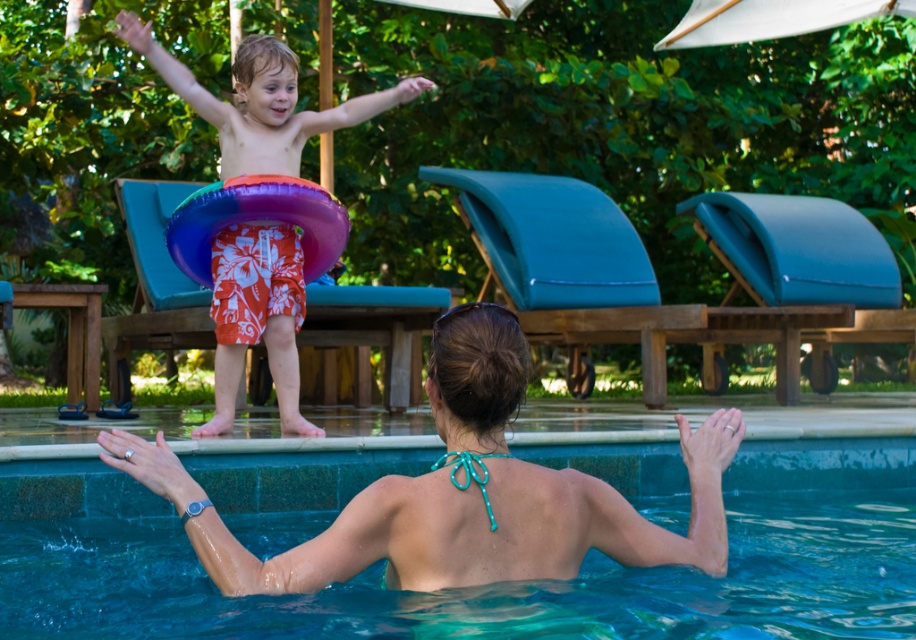
Question: Which is nearer to the white fabric umbrella at upper center?

Choices:
 (A) blue smooth water at upper center
 (B) purple inflatable ring at upper center
 (C) teal fabric bikini top at upper center

Answer: (B)

Question: Estimate the real-world distances between objects in this image. Which object is farther from the teal fabric bikini top at upper center?

Choices:
 (A) purple inflatable ring at upper center
 (B) white fabric umbrella at upper center
 (C) orange floral shorts at upper center
 (D) blue smooth water at upper center

Answer: (B)

Question: Is blue smooth water at upper center closer to camera compared to orange floral shorts at upper center?

Choices:
 (A) yes
 (B) no

Answer: (A)

Question: Considering the relative positions of purple inflatable ring at upper center and white fabric umbrella at upper center in the image provided, where is purple inflatable ring at upper center located with respect to white fabric umbrella at upper center?

Choices:
 (A) below
 (B) above

Answer: (A)

Question: Which of these objects is positioned closest to the blue smooth water at upper center?

Choices:
 (A) orange floral shorts at upper center
 (B) purple inflatable ring at upper center
 (C) white fabric umbrella at upper center
 (D) teal fabric bikini top at upper center

Answer: (B)

Question: Does teal fabric bikini top at upper center appear over purple inflatable ring at upper center?

Choices:
 (A) no
 (B) yes

Answer: (A)